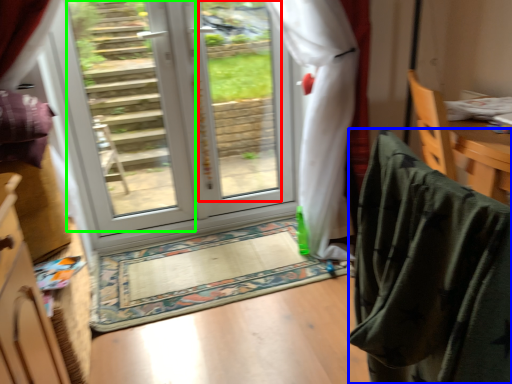
Question: Which object is positioned farthest from window screen (highlighted by a red box)? Select from blanket (highlighted by a blue box) and glass door (highlighted by a green box).

Choices:
 (A) blanket
 (B) glass door

Answer: (A)